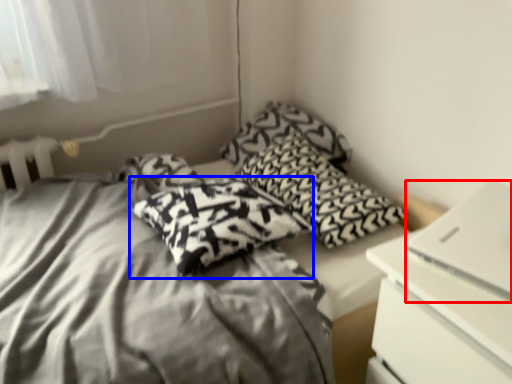
Question: Among these objects, which one is nearest to the camera, computer (highlighted by a red box) or pillow (highlighted by a blue box)?

Choices:
 (A) computer
 (B) pillow

Answer: (A)